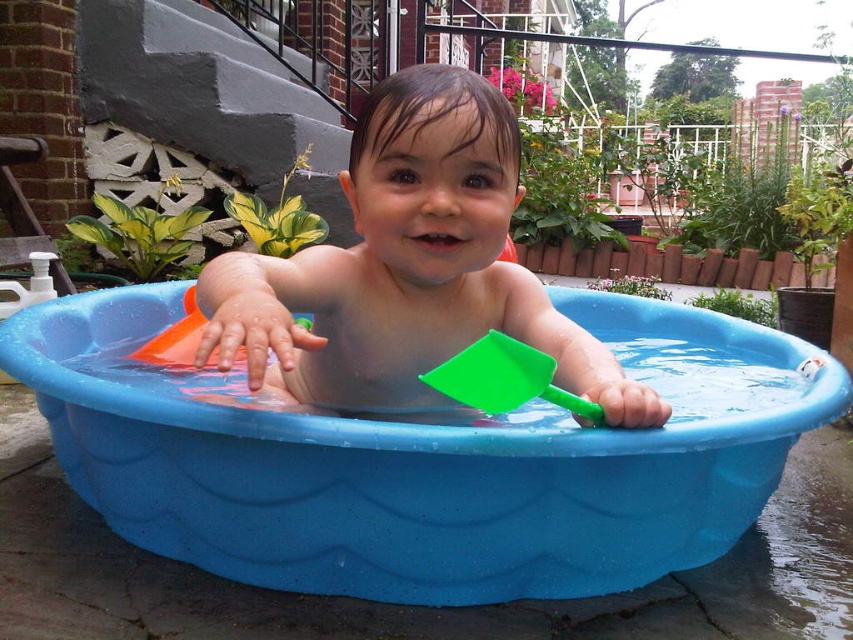
The image shows a young child playing in a blue plastic wading pool. The child is holding a bright green plastic shovel and an orange plastic toy boat. There is a point at coordinates (419,465). According to the scene, where is this point located?

The point at coordinates (419,465) is located on the blue plastic bath at center.

You are a parent trying to ensure your child stays safe while playing in the blue plastic bath at center. The child is holding a green plastic shovel at center. Considering the height difference between the bath and the shovel, which item is more likely to be stable and less likely to tip over?

The blue plastic bath at center is much taller than the green plastic shovel at center, so it has a lower center of gravity and is more stable, making it less likely to tip over.

You are a parent trying to retrieve the green plastic shovel at center from your child. The smooth plastic toddler at center is holding it. Can you easily take the shovel from the toddler?

The smooth plastic toddler at center is positioned over green plastic shovel at center, meaning the toddler is likely sitting on or blocking access to the shovel, making it difficult to retrieve without disturbing the child.